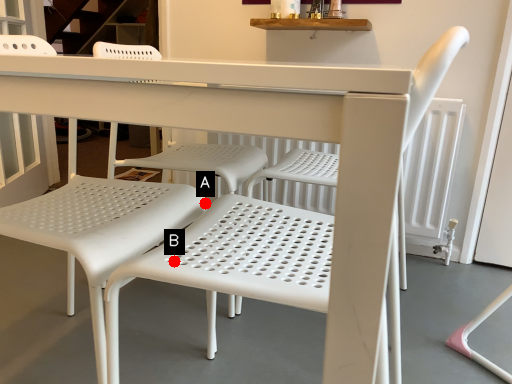
Question: Two points are circled on the image, labeled by A and B beside each circle. Which point is closer to the camera?

Choices:
 (A) A is closer
 (B) B is closer

Answer: (B)